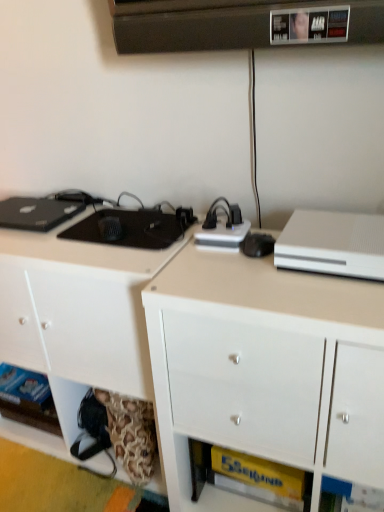
You are a GUI agent. You are given a task and a screenshot of the screen. Output one action in this format:
    pyautogui.click(x=<x>, y=<y>)
    Task: Click on the vacant space in front of white matte desktop computer at upper right
    
    Given the screenshot: What is the action you would take?
    pyautogui.click(x=339, y=302)